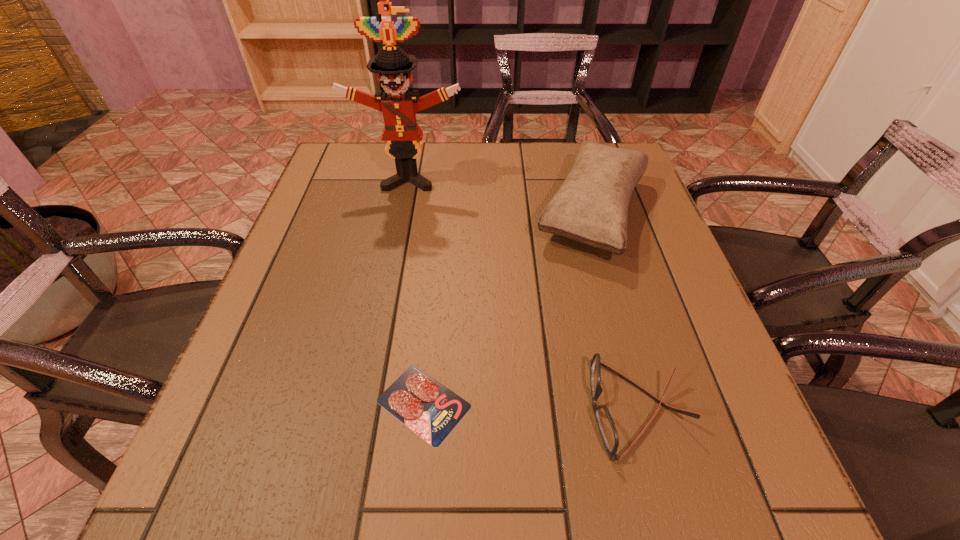
Locate an element on the screen. The width and height of the screenshot is (960, 540). unoccupied area between the shortest object and the nutcracker is located at coordinates (417, 292).

Where is `empty space between the spectacles and the tallest object`? Image resolution: width=960 pixels, height=540 pixels. empty space between the spectacles and the tallest object is located at coordinates (523, 294).

The image size is (960, 540). Find the location of `vacant point located between the salami and the tallest object`. vacant point located between the salami and the tallest object is located at coordinates (417, 292).

This screenshot has width=960, height=540. Identify the location of empty space that is in between the second tallest object and the shortest object. (509, 308).

I want to click on free spot between the salami and the tallest object, so click(417, 292).

Identify which object is the third closest to the tallest object. Please provide its 2D coordinates. Your answer should be formatted as a tuple, i.e. [(x, y)], where the tuple contains the x and y coordinates of a point satisfying the conditions above.

[(608, 432)]

Locate an element on the screen. The image size is (960, 540). object identified as the third closest to the third shortest object is located at coordinates (430, 409).

Where is `blank area in the image that satisfies the following two spatial constraints: 1. on the front-facing side of the shortest object; 2. on the left side of the tallest object`? Image resolution: width=960 pixels, height=540 pixels. blank area in the image that satisfies the following two spatial constraints: 1. on the front-facing side of the shortest object; 2. on the left side of the tallest object is located at coordinates (365, 403).